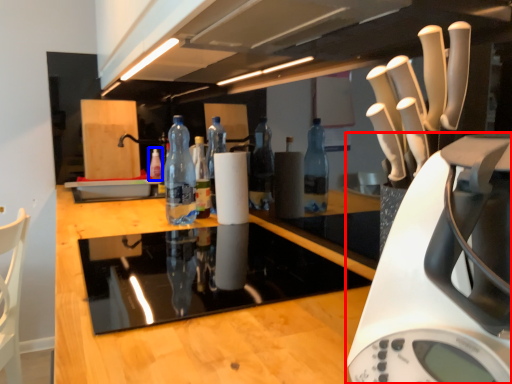
Question: Among these objects, which one is farthest to the camera, home appliance (highlighted by a red box) or bottle (highlighted by a blue box)?

Choices:
 (A) home appliance
 (B) bottle

Answer: (B)